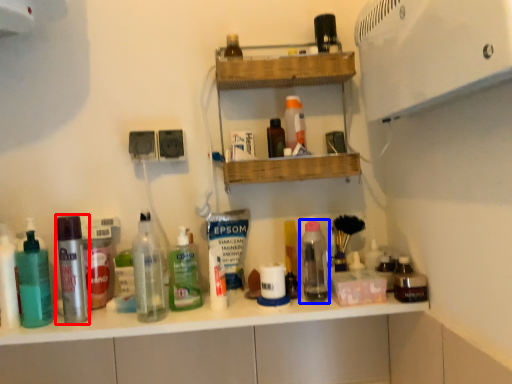
Question: Among these objects, which one is nearest to the camera, bottle (highlighted by a red box) or bottle (highlighted by a blue box)?

Choices:
 (A) bottle
 (B) bottle

Answer: (A)